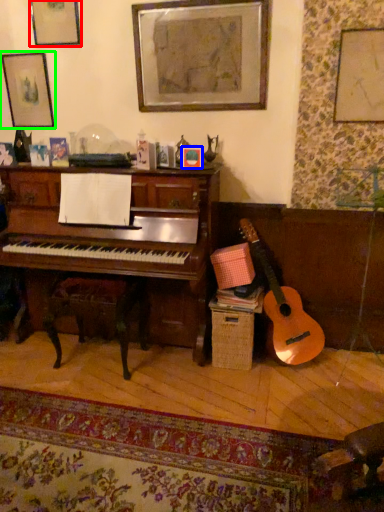
Question: Estimate the real-world distances between objects in this image. Which object is farther from picture frame (highlighted by a red box), picture frame (highlighted by a blue box) or picture frame (highlighted by a green box)?

Choices:
 (A) picture frame
 (B) picture frame

Answer: (A)